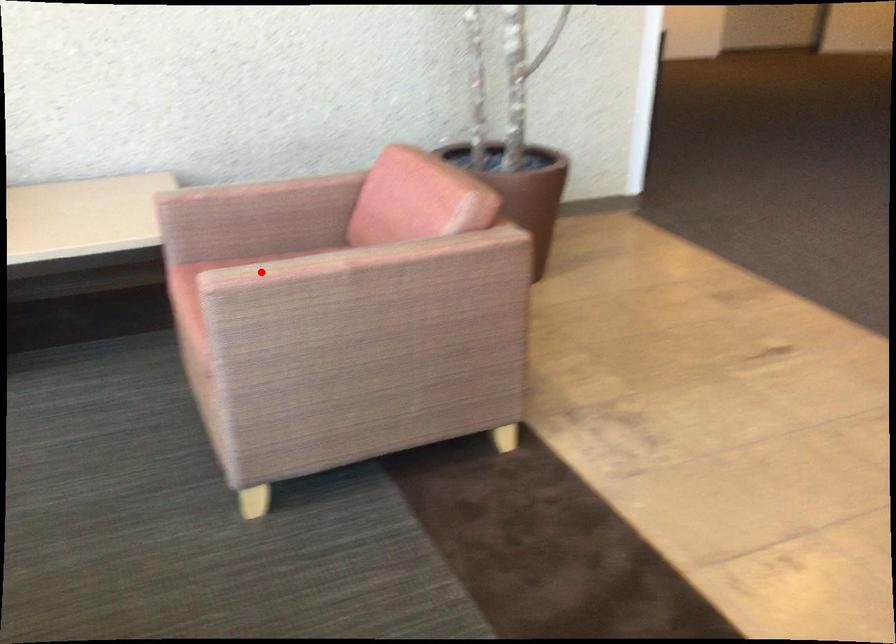
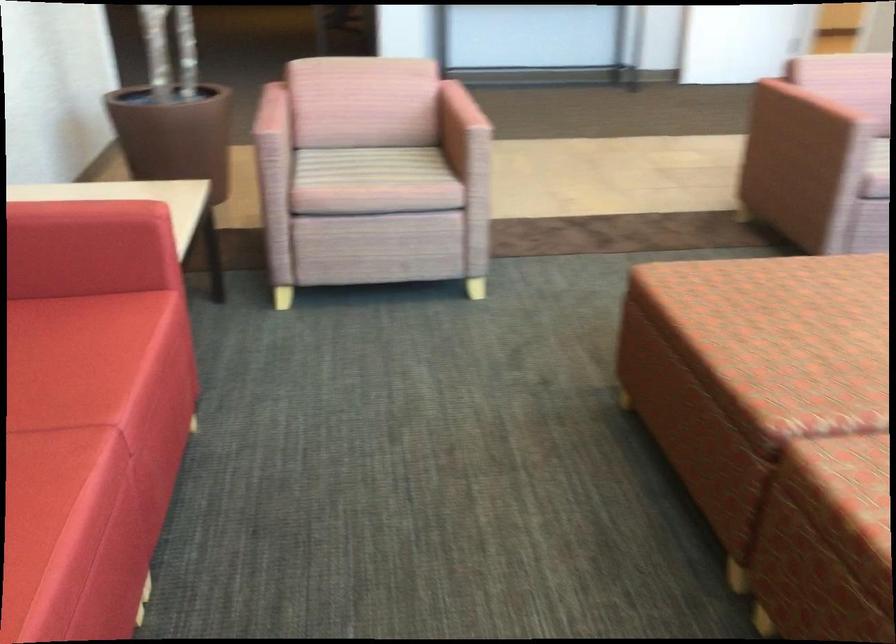
Where in the second image is the point corresponding to the highlighted location from the first image?

(459, 118)